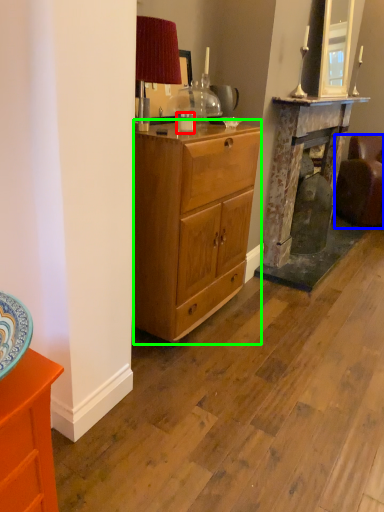
Question: Which object is the farthest from coffee cup (highlighted by a red box)? Choose among these: studio couch (highlighted by a blue box) or desk (highlighted by a green box).

Choices:
 (A) studio couch
 (B) desk

Answer: (A)